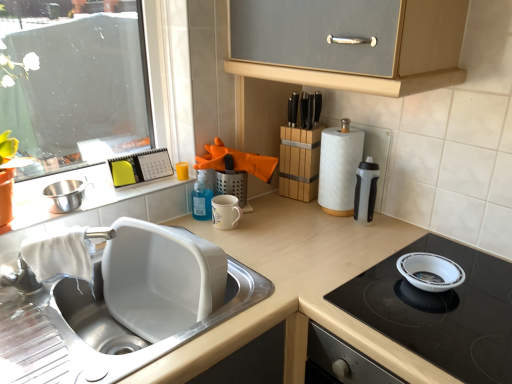
Question: From a real-world perspective, is white glossy sink at lower left positioned above or below white glossy window sill at upper left?

Choices:
 (A) above
 (B) below

Answer: (B)

Question: In the image, is white glossy sink at lower left positioned in front of or behind white glossy window sill at upper left?

Choices:
 (A) behind
 (B) front

Answer: (B)

Question: Which object is positioned closest to the white glossy bowl at upper right?

Choices:
 (A) white glossy window sill at upper left
 (B) white textured paper towel at right
 (C) white glossy sink at lower left
 (D) stainless steel mixing bowl at sink left
 (E) matte white countertop at center

Answer: (E)

Question: Which of these objects is positioned farthest from the white glossy bowl at upper right?

Choices:
 (A) white textured paper towel at right
 (B) white glossy window sill at upper left
 (C) stainless steel mixing bowl at sink left
 (D) white glossy sink at lower left
 (E) translucent plastic water bottle at right

Answer: (C)